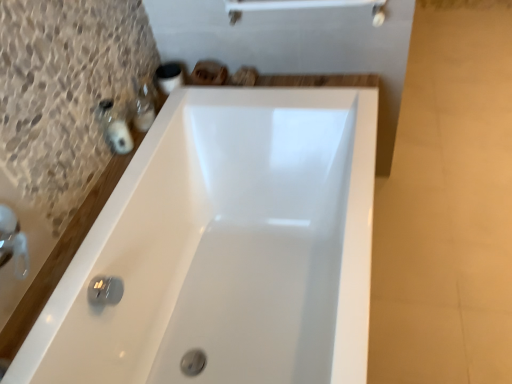
Identify the location of matte plastic soap dispenser at upper left, which is the 2th toiletry from front to back. The height and width of the screenshot is (384, 512). (143, 107).

Describe the element at coordinates (120, 137) in the screenshot. The width and height of the screenshot is (512, 384). I see `matte black soap at left, placed as the 1th toiletry when sorted from front to back` at that location.

Where is `matte plastic soap dispenser at upper left, arranged as the 1th toiletry when viewed from the back`? This screenshot has height=384, width=512. matte plastic soap dispenser at upper left, arranged as the 1th toiletry when viewed from the back is located at coordinates (143, 107).

Between matte black soap at left, placed as the 1th toiletry when sorted from front to back, and white glossy bathtub at center, which one has larger size?

Bigger between the two is white glossy bathtub at center.

Is matte black soap at left, placed as the 1th toiletry when sorted from front to back, next to white glossy bathtub at center and touching it?

matte black soap at left, placed as the 1th toiletry when sorted from front to back, and white glossy bathtub at center are not in contact.

Between matte black soap at left, placed as the 1th toiletry when sorted from front to back, and white glossy bathtub at center, which one is positioned in front?

white glossy bathtub at center is more forward.

Considering the sizes of objects matte plastic soap dispenser at upper left, which is the 2th toiletry from front to back, and white glossy bathtub at center in the image provided, who is smaller, matte plastic soap dispenser at upper left, which is the 2th toiletry from front to back, or white glossy bathtub at center?

matte plastic soap dispenser at upper left, which is the 2th toiletry from front to back, is smaller.

What's the angular difference between matte plastic soap dispenser at upper left, which is the 2th toiletry from front to back, and white glossy bathtub at center's facing directions?

The facing directions of matte plastic soap dispenser at upper left, which is the 2th toiletry from front to back, and white glossy bathtub at center are 3.76 degrees apart.

From a real-world perspective, is matte plastic soap dispenser at upper left, arranged as the 1th toiletry when viewed from the back, physically below white glossy bathtub at center?

No, from a real-world perspective, matte plastic soap dispenser at upper left, arranged as the 1th toiletry when viewed from the back, is not beneath white glossy bathtub at center.

Is white glossy bathtub at center surrounded by matte plastic soap dispenser at upper left, which is the 2th toiletry from front to back?

No.

Consider the image. Can you tell me how much white glossy bathtub at center and matte black soap at left, the 2th toiletry when ordered from back to front, differ in facing direction?

They differ by 6.5 degrees in their facing directions.

Is white glossy bathtub at center completely or partially outside of matte black soap at left, placed as the 1th toiletry when sorted from front to back?

Yes, white glossy bathtub at center is outside of matte black soap at left, placed as the 1th toiletry when sorted from front to back.

Is white glossy bathtub at center looking in the opposite direction of matte black soap at left, the 2th toiletry when ordered from back to front?

No.

Is white glossy bathtub at center in contact with matte black soap at left, the 2th toiletry when ordered from back to front?

white glossy bathtub at center and matte black soap at left, the 2th toiletry when ordered from back to front, are clearly separated.

Is white glossy bathtub at center bigger or smaller than matte plastic soap dispenser at upper left, which is the 2th toiletry from front to back?

In the image, white glossy bathtub at center appears to be larger than matte plastic soap dispenser at upper left, which is the 2th toiletry from front to back.

From a real-world perspective, between white glossy bathtub at center and matte plastic soap dispenser at upper left, which is the 2th toiletry from front to back, who is vertically higher?

From a 3D spatial view, matte plastic soap dispenser at upper left, which is the 2th toiletry from front to back, is above.

In order to click on bathtub in front of the matte plastic soap dispenser at upper left, arranged as the 1th toiletry when viewed from the back in this screenshot , I will do `click(226, 248)`.

Can you confirm if white glossy bathtub at center is positioned to the left of matte plastic soap dispenser at upper left, which is the 2th toiletry from front to back?

Incorrect, white glossy bathtub at center is not on the left side of matte plastic soap dispenser at upper left, which is the 2th toiletry from front to back.

Can you confirm if matte plastic soap dispenser at upper left, arranged as the 1th toiletry when viewed from the back, is taller than matte black soap at left, placed as the 1th toiletry when sorted from front to back?

Incorrect, the height of matte plastic soap dispenser at upper left, arranged as the 1th toiletry when viewed from the back, is not larger of that of matte black soap at left, placed as the 1th toiletry when sorted from front to back.

Consider the image. Considering the positions of objects matte plastic soap dispenser at upper left, arranged as the 1th toiletry when viewed from the back, and matte black soap at left, the 2th toiletry when ordered from back to front, in the image provided, who is more to the right, matte plastic soap dispenser at upper left, arranged as the 1th toiletry when viewed from the back, or matte black soap at left, the 2th toiletry when ordered from back to front,?

Positioned to the right is matte plastic soap dispenser at upper left, arranged as the 1th toiletry when viewed from the back.

From the image's perspective, between matte plastic soap dispenser at upper left, which is the 2th toiletry from front to back, and matte black soap at left, placed as the 1th toiletry when sorted from front to back, who is located below?

matte black soap at left, placed as the 1th toiletry when sorted from front to back, appears lower in the image.

Is matte plastic soap dispenser at upper left, arranged as the 1th toiletry when viewed from the back, facing towards matte black soap at left, placed as the 1th toiletry when sorted from front to back?

No.

How different are the orientations of matte black soap at left, placed as the 1th toiletry when sorted from front to back, and matte plastic soap dispenser at upper left, arranged as the 1th toiletry when viewed from the back, in degrees?

The angular difference between matte black soap at left, placed as the 1th toiletry when sorted from front to back, and matte plastic soap dispenser at upper left, arranged as the 1th toiletry when viewed from the back, is 2.74 degrees.

Considering the relative sizes of matte black soap at left, the 2th toiletry when ordered from back to front, and matte plastic soap dispenser at upper left, which is the 2th toiletry from front to back, in the image provided, is matte black soap at left, the 2th toiletry when ordered from back to front, bigger than matte plastic soap dispenser at upper left, which is the 2th toiletry from front to back,?

No, matte black soap at left, the 2th toiletry when ordered from back to front, is not bigger than matte plastic soap dispenser at upper left, which is the 2th toiletry from front to back.

Is matte black soap at left, the 2th toiletry when ordered from back to front, not within matte plastic soap dispenser at upper left, arranged as the 1th toiletry when viewed from the back?

That's correct, matte black soap at left, the 2th toiletry when ordered from back to front, is outside of matte plastic soap dispenser at upper left, arranged as the 1th toiletry when viewed from the back.

How distant is matte black soap at left, the 2th toiletry when ordered from back to front, from matte plastic soap dispenser at upper left, which is the 2th toiletry from front to back?

matte black soap at left, the 2th toiletry when ordered from back to front, and matte plastic soap dispenser at upper left, which is the 2th toiletry from front to back, are 6.17 inches apart from each other.

At what (x,y) coordinates should I click in order to perform the action: click on bathtub directly beneath the matte black soap at left, the 2th toiletry when ordered from back to front (from a real-world perspective). Please return your answer as a coordinate pair (x, y). This screenshot has height=384, width=512. Looking at the image, I should click on click(226, 248).

This screenshot has height=384, width=512. I want to click on bathtub that appears on the right of matte plastic soap dispenser at upper left, arranged as the 1th toiletry when viewed from the back, so click(x=226, y=248).

Based on their spatial positions, is matte black soap at left, the 2th toiletry when ordered from back to front, or white glossy bathtub at center further from matte plastic soap dispenser at upper left, which is the 2th toiletry from front to back?

Among the two, white glossy bathtub at center is located further to matte plastic soap dispenser at upper left, which is the 2th toiletry from front to back.

Estimate the real-world distances between objects in this image. Which object is closer to matte black soap at left, placed as the 1th toiletry when sorted from front to back, matte plastic soap dispenser at upper left, arranged as the 1th toiletry when viewed from the back, or white glossy bathtub at center?

The object closer to matte black soap at left, placed as the 1th toiletry when sorted from front to back, is matte plastic soap dispenser at upper left, arranged as the 1th toiletry when viewed from the back.

From the image, which object appears to be nearer to white glossy bathtub at center, matte black soap at left, placed as the 1th toiletry when sorted from front to back, or matte plastic soap dispenser at upper left, which is the 2th toiletry from front to back?

matte black soap at left, placed as the 1th toiletry when sorted from front to back, is closer to white glossy bathtub at center.

From the image, which object appears to be farther from matte black soap at left, the 2th toiletry when ordered from back to front, white glossy bathtub at center or matte plastic soap dispenser at upper left, which is the 2th toiletry from front to back?

The object further to matte black soap at left, the 2th toiletry when ordered from back to front, is white glossy bathtub at center.

Based on their spatial positions, is white glossy bathtub at center or matte black soap at left, placed as the 1th toiletry when sorted from front to back, further from matte plastic soap dispenser at upper left, arranged as the 1th toiletry when viewed from the back?

The object further to matte plastic soap dispenser at upper left, arranged as the 1th toiletry when viewed from the back, is white glossy bathtub at center.

Estimate the real-world distances between objects in this image. Which object is closer to white glossy bathtub at center, matte plastic soap dispenser at upper left, which is the 2th toiletry from front to back, or matte black soap at left, the 2th toiletry when ordered from back to front?

Based on the image, matte black soap at left, the 2th toiletry when ordered from back to front, appears to be nearer to white glossy bathtub at center.

The height and width of the screenshot is (384, 512). Identify the location of toiletry between white glossy bathtub at center and matte plastic soap dispenser at upper left, arranged as the 1th toiletry when viewed from the back, from front to back. (120, 137).